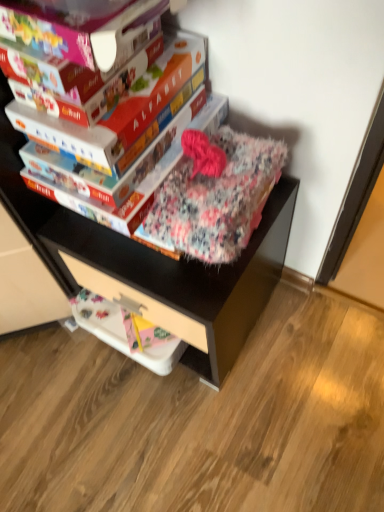
Question: Considering the relative sizes of fluffy fabric bag at upper center and matte cardboard book at upper center, the 2th paperback book in the front-to-back sequence, in the image provided, is fluffy fabric bag at upper center bigger than matte cardboard book at upper center, the 2th paperback book in the front-to-back sequence,?

Choices:
 (A) no
 (B) yes

Answer: (B)

Question: From the image's perspective, is fluffy fabric bag at upper center on top of matte cardboard book at upper center, the 2th paperback book in the front-to-back sequence?

Choices:
 (A) no
 (B) yes

Answer: (A)

Question: Can you see fluffy fabric bag at upper center touching matte cardboard book at upper center, the second paperback book from the back?

Choices:
 (A) yes
 (B) no

Answer: (B)

Question: Is fluffy fabric bag at upper center positioned behind matte cardboard book at upper center, the 2th paperback book in the front-to-back sequence?

Choices:
 (A) no
 (B) yes

Answer: (B)

Question: Is fluffy fabric bag at upper center wider than matte cardboard book at upper center, the 2th paperback book in the front-to-back sequence?

Choices:
 (A) yes
 (B) no

Answer: (A)

Question: Does fluffy fabric bag at upper center lie in front of matte cardboard book at upper center, the 2th paperback book in the front-to-back sequence?

Choices:
 (A) no
 (B) yes

Answer: (A)

Question: Is matte cardboard book at upper center, the second paperback book from the back, completely or partially outside of fluffy floral blanket at center?

Choices:
 (A) no
 (B) yes

Answer: (B)

Question: Does matte cardboard book at upper center, the 2th paperback book in the front-to-back sequence, appear on the left side of fluffy floral blanket at center?

Choices:
 (A) yes
 (B) no

Answer: (A)

Question: Considering the relative sizes of matte cardboard book at upper center, the 2th paperback book in the front-to-back sequence, and fluffy floral blanket at center in the image provided, is matte cardboard book at upper center, the 2th paperback book in the front-to-back sequence, bigger than fluffy floral blanket at center?

Choices:
 (A) no
 (B) yes

Answer: (A)

Question: Is fluffy floral blanket at center at the back of matte cardboard book at upper center, the 2th paperback book in the front-to-back sequence?

Choices:
 (A) no
 (B) yes

Answer: (A)

Question: Is the position of matte cardboard book at upper center, the 2th paperback book in the front-to-back sequence, more distant than that of fluffy floral blanket at center?

Choices:
 (A) no
 (B) yes

Answer: (B)

Question: Can you confirm if matte cardboard book at upper center, the second paperback book from the back, is smaller than fluffy floral blanket at center?

Choices:
 (A) no
 (B) yes

Answer: (B)

Question: Does matte cardboard book at center, positioned as the 1th paperback book in back-to-front order, have a lesser height compared to white plastic drawer at lower center?

Choices:
 (A) yes
 (B) no

Answer: (B)